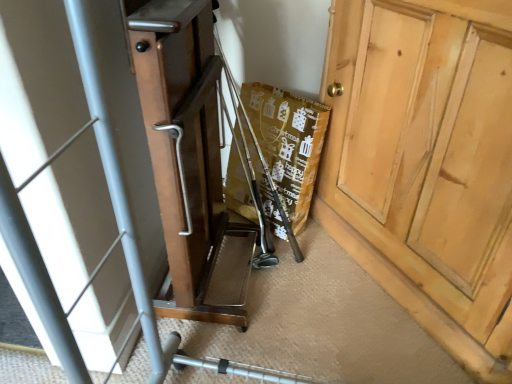
Question: From a real-world perspective, is metallic silver baby carriage at lower center physically located above or below light brown wooden cabinet at right?

Choices:
 (A) below
 (B) above

Answer: (B)

Question: Is point (168, 119) closer or farther from the camera than point (499, 350)?

Choices:
 (A) closer
 (B) farther

Answer: (A)

Question: Considering the positions of metallic silver baby carriage at lower center and light brown wooden cabinet at right in the image, is metallic silver baby carriage at lower center wider or thinner than light brown wooden cabinet at right?

Choices:
 (A) thin
 (B) wide

Answer: (B)

Question: From the image's perspective, relative to metallic silver baby carriage at lower center, is light brown wooden cabinet at right above or below?

Choices:
 (A) above
 (B) below

Answer: (A)

Question: Is light brown wooden cabinet at right wider or thinner than metallic silver baby carriage at lower center?

Choices:
 (A) wide
 (B) thin

Answer: (B)

Question: Considering their positions, is light brown wooden cabinet at right located in front of or behind metallic silver baby carriage at lower center?

Choices:
 (A) behind
 (B) front

Answer: (A)

Question: Looking at the image, does light brown wooden cabinet at right seem bigger or smaller compared to metallic silver baby carriage at lower center?

Choices:
 (A) small
 (B) big

Answer: (A)